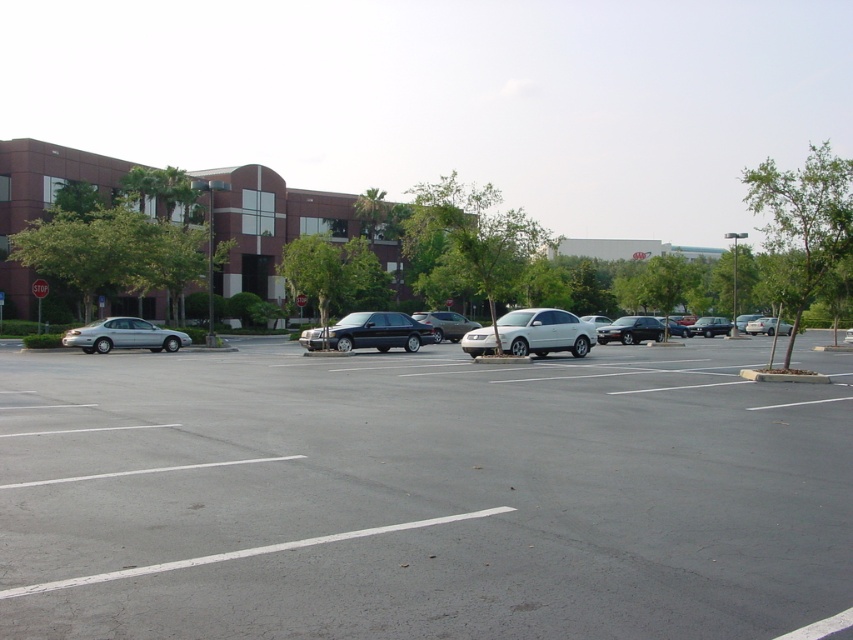
Question: Among these points, which one is farthest from the camera?

Choices:
 (A) (84, 349)
 (B) (643, 330)
 (C) (566, 413)

Answer: (B)

Question: Does satin black sedan at center have a larger size compared to silver metallic sedan at center?

Choices:
 (A) no
 (B) yes

Answer: (A)

Question: Which is farther from the silver metallic car at center?

Choices:
 (A) shiny black sedan at center-right
 (B) silver metallic sedan at center

Answer: (A)

Question: Is silver metallic sedan at center positioned in front of silver metallic sedan at right?

Choices:
 (A) no
 (B) yes

Answer: (A)

Question: Can you confirm if satin black sedan at center is positioned to the right of silver metallic sedan at right?

Choices:
 (A) no
 (B) yes

Answer: (A)

Question: Among these objects, which one is farthest from the camera?

Choices:
 (A) shiny black sedan at center
 (B) silver metallic sedan at right
 (C) satin black sedan at center

Answer: (A)